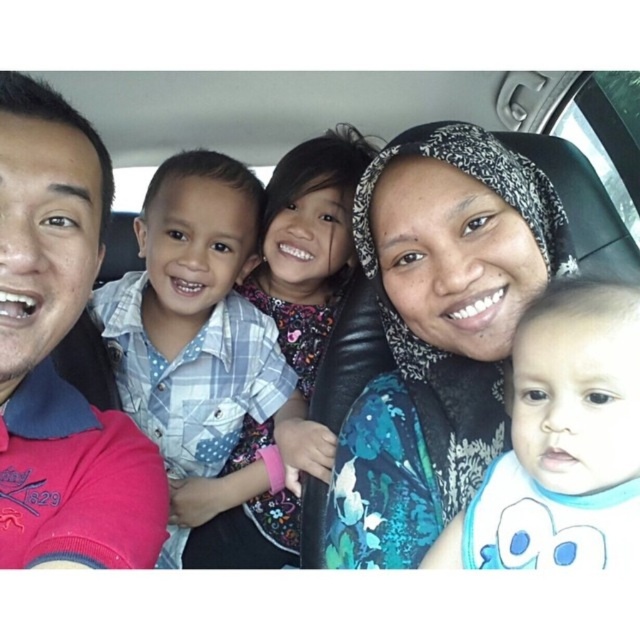
Measure the distance between point (x=552, y=380) and camera.

Point (x=552, y=380) and camera are 24.23 inches apart from each other.

Between white soft bib at lower right and plaid fabric shirt at center, which one appears on the left side from the viewer's perspective?

plaid fabric shirt at center

Does point (611, 532) come behind point (289, 436)?

No, it is in front of (289, 436).

What are the coordinates of `white soft bib at lower right` in the screenshot? It's located at (561, 440).

Is floral-patterned headscarf at center below plaid fabric shirt at center?

Indeed, floral-patterned headscarf at center is positioned under plaid fabric shirt at center.

Can you confirm if floral-patterned headscarf at center is positioned to the right of plaid fabric shirt at center?

Yes, floral-patterned headscarf at center is to the right of plaid fabric shirt at center.

Locate an element on the screen. This screenshot has height=640, width=640. floral-patterned headscarf at center is located at coordinates (436, 336).

You are a GUI agent. You are given a task and a screenshot of the screen. Output one action in this format:
    pyautogui.click(x=<x>, y=<y>)
    Task: Click on the pink fabric shirt at left
    The height and width of the screenshot is (640, 640).
    Given the screenshot: What is the action you would take?
    pyautogui.click(x=52, y=346)

Locate an element on the screen. The image size is (640, 640). pink fabric shirt at left is located at coordinates (52, 346).